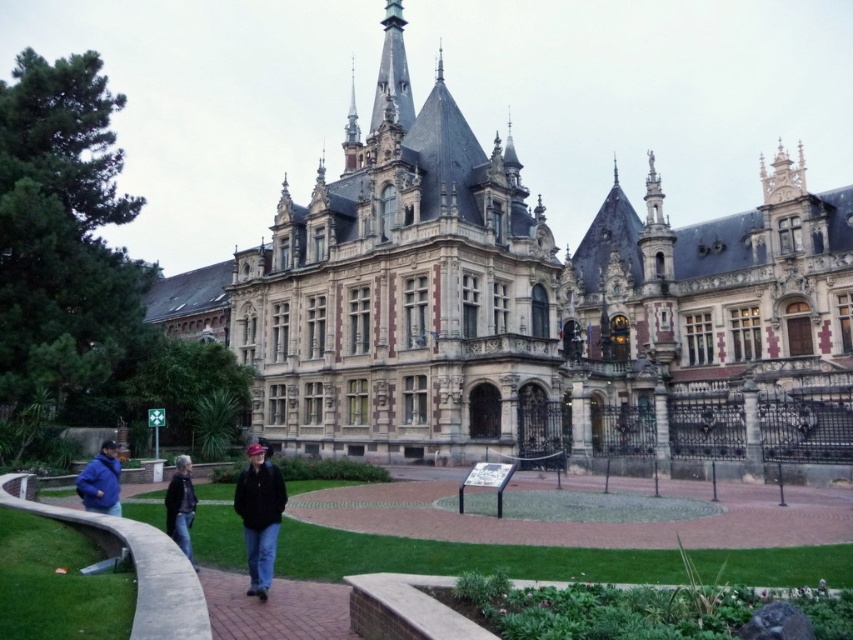
In the scene shown: You are standing in front of the grand Gothic building and notice the green grass at lower center and the blue matte jacket at lower left. Which object covers a larger area in the scene?

The green grass at lower center covers a larger area than the blue matte jacket at lower left because its width is greater.